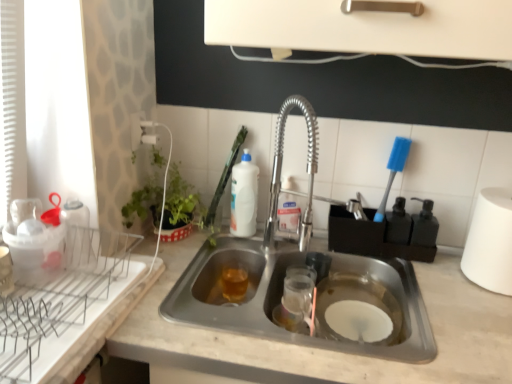
Question: From a real-world perspective, is white matte paper towel at right positioned over white plastic brush at upper center based on gravity?

Choices:
 (A) yes
 (B) no

Answer: (B)

Question: Considering the relative positions of white matte paper towel at right and white plastic brush at upper center in the image provided, is white matte paper towel at right behind white plastic brush at upper center?

Choices:
 (A) yes
 (B) no

Answer: (B)

Question: Is white matte paper towel at right positioned before white plastic brush at upper center?

Choices:
 (A) yes
 (B) no

Answer: (A)

Question: Can you confirm if white matte paper towel at right is smaller than white plastic brush at upper center?

Choices:
 (A) no
 (B) yes

Answer: (A)

Question: Can you confirm if white matte paper towel at right is taller than white plastic brush at upper center?

Choices:
 (A) no
 (B) yes

Answer: (B)

Question: Looking at the image, does white glossy bottle at upper center, the second beverage positioned from the bottom, seem bigger or smaller compared to translucent amber liquid at sink bottom, the 1th beverage in the bottom-to-top sequence?

Choices:
 (A) big
 (B) small

Answer: (A)

Question: From their relative heights in the image, would you say white glossy bottle at upper center, arranged as the first beverage when viewed from the top, is taller or shorter than translucent amber liquid at sink bottom, the 1th beverage in the bottom-to-top sequence?

Choices:
 (A) tall
 (B) short

Answer: (A)

Question: Relative to translucent amber liquid at sink bottom, which ranks as the 2th beverage in top-to-bottom order, is white glossy bottle at upper center, the second beverage positioned from the bottom, in front or behind?

Choices:
 (A) behind
 (B) front

Answer: (A)

Question: Is white glossy bottle at upper center, the second beverage positioned from the bottom, inside or outside of translucent amber liquid at sink bottom, the 1th beverage in the bottom-to-top sequence?

Choices:
 (A) inside
 (B) outside

Answer: (B)

Question: From the image's perspective, is white glossy bottle at upper center, arranged as the first beverage when viewed from the top, located above or below white marble countertop at center?

Choices:
 (A) below
 (B) above

Answer: (B)

Question: Considering the positions of white glossy bottle at upper center, arranged as the first beverage when viewed from the top, and white marble countertop at center in the image, is white glossy bottle at upper center, arranged as the first beverage when viewed from the top, wider or thinner than white marble countertop at center?

Choices:
 (A) thin
 (B) wide

Answer: (A)

Question: Is white glossy bottle at upper center, arranged as the first beverage when viewed from the top, inside or outside of white marble countertop at center?

Choices:
 (A) inside
 (B) outside

Answer: (B)

Question: In terms of height, does white glossy bottle at upper center, the second beverage positioned from the bottom, look taller or shorter compared to white marble countertop at center?

Choices:
 (A) short
 (B) tall

Answer: (A)

Question: In terms of width, does white marble countertop at center look wider or thinner when compared to white glossy bottle at upper center, arranged as the first beverage when viewed from the top?

Choices:
 (A) wide
 (B) thin

Answer: (A)

Question: Considering the positions of white marble countertop at center and white glossy bottle at upper center, the second beverage positioned from the bottom, in the image, is white marble countertop at center taller or shorter than white glossy bottle at upper center, the second beverage positioned from the bottom,?

Choices:
 (A) tall
 (B) short

Answer: (A)